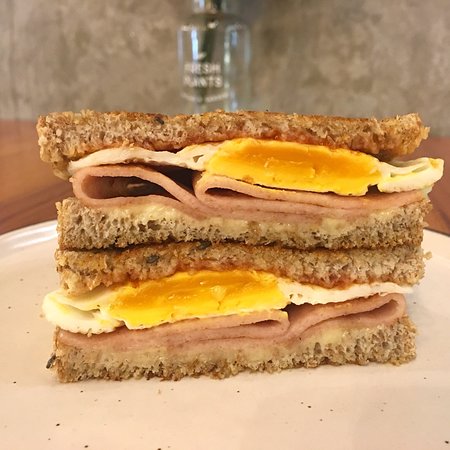
Find the location of a particular element. beige speckled plate is located at coordinates (395, 423).